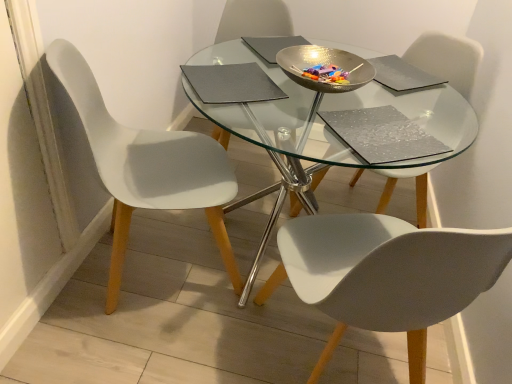
Question: From the image's perspective, is transparent glass table at center located above white matte chair at center, which appears as the third chair when viewed from the left?

Choices:
 (A) no
 (B) yes

Answer: (A)

Question: Considering the relative sizes of transparent glass table at center and white matte chair at center, the 1th chair from the right, in the image provided, is transparent glass table at center shorter than white matte chair at center, the 1th chair from the right,?

Choices:
 (A) yes
 (B) no

Answer: (A)

Question: Is transparent glass table at center to the left of white matte chair at center, which appears as the third chair when viewed from the left, from the viewer's perspective?

Choices:
 (A) yes
 (B) no

Answer: (A)

Question: Is transparent glass table at center located outside white matte chair at center, the 1th chair from the right?

Choices:
 (A) yes
 (B) no

Answer: (A)

Question: From a real-world perspective, is transparent glass table at center located higher than white matte chair at center, which appears as the third chair when viewed from the left?

Choices:
 (A) yes
 (B) no

Answer: (B)

Question: Is transparent glass table at center smaller than white matte chair at center, the 1th chair from the right?

Choices:
 (A) no
 (B) yes

Answer: (A)

Question: Does white matte chair at left, which is the 1th chair in left-to-right order, have a greater width compared to matte gray pad at upper right, which is counted as the second pad, starting from the top?

Choices:
 (A) yes
 (B) no

Answer: (A)

Question: From the image's perspective, is white matte chair at left, which is the 1th chair in left-to-right order, above matte gray pad at upper right, acting as the third pad starting from the bottom?

Choices:
 (A) no
 (B) yes

Answer: (A)

Question: Is white matte chair at left, acting as the third chair starting from the right, not within matte gray pad at upper right, which is counted as the second pad, starting from the top?

Choices:
 (A) no
 (B) yes

Answer: (B)

Question: Is white matte chair at left, which is the 1th chair in left-to-right order, looking in the opposite direction of matte gray pad at upper right, which is counted as the second pad, starting from the top?

Choices:
 (A) yes
 (B) no

Answer: (B)

Question: From a real-world perspective, does white matte chair at left, which is the 1th chair in left-to-right order, sit lower than matte gray pad at upper right, acting as the third pad starting from the bottom?

Choices:
 (A) yes
 (B) no

Answer: (A)

Question: Does white matte chair at left, acting as the third chair starting from the right, have a larger size compared to matte gray pad at upper right, acting as the third pad starting from the bottom?

Choices:
 (A) no
 (B) yes

Answer: (B)

Question: Is white matte chair at center, the second chair positioned from the left, smaller than white matte chair at center, the 1th chair from the right?

Choices:
 (A) yes
 (B) no

Answer: (B)